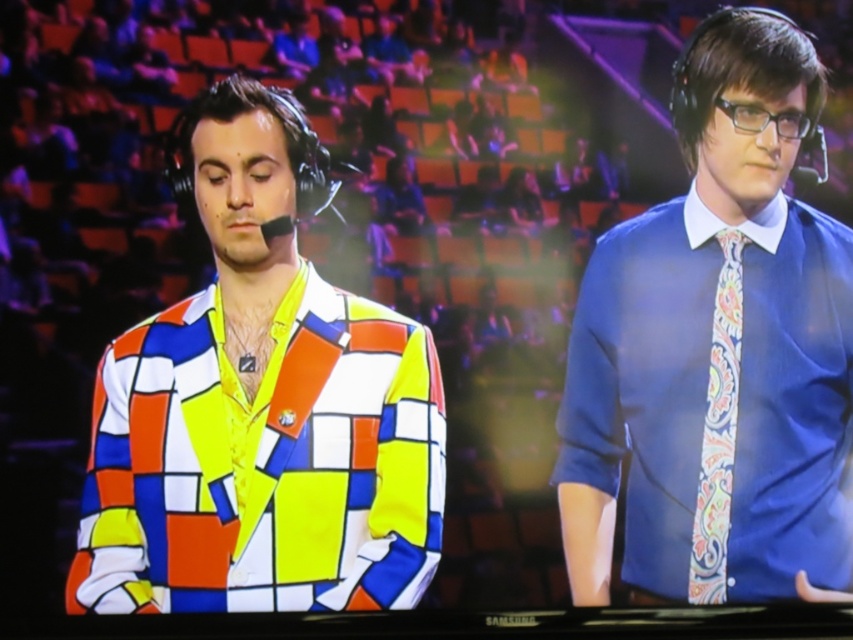
You are a costume designer preparing for a performance. You need to choose between the multicolored fabric shirt at left and the blue satin shirt at center. Based on their sizes, which one would you select if you want a more dramatic presence on stage?

The multicolored fabric shirt at left has a larger size compared to the blue satin shirt at center, so it would create a more dramatic presence on stage due to its bigger size.